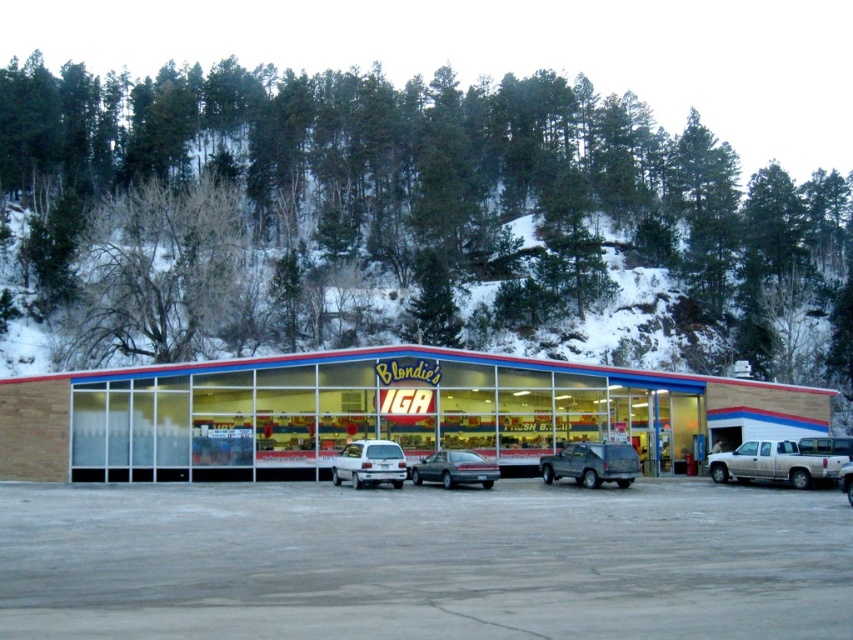
Looking at this image, does wooden siding building at center have a greater width compared to matte gray suv at center?

Indeed, wooden siding building at center has a greater width compared to matte gray suv at center.

Is wooden siding building at center positioned at the back of matte gray suv at center?

Yes, it is.

Does point (282, 372) lie in front of point (572, 467)?

That is False.

Identify the location of wooden siding building at center. (374, 412).

Does matte gray suv at center appear on the right side of white matte hatchback at center?

Correct, you'll find matte gray suv at center to the right of white matte hatchback at center.

Who is lower down, matte gray suv at center or white matte hatchback at center?

matte gray suv at center

Identify the location of matte gray suv at center. (590, 464).

Who is shorter, matte gray suv at center or silver metallic truck at center?

Standing shorter between the two is matte gray suv at center.

Is matte gray suv at center thinner than silver metallic truck at center?

Yes, matte gray suv at center is thinner than silver metallic truck at center.

Who is more forward, (563, 461) or (846, 492)?

Positioned in front is point (846, 492).

Where is `matte gray suv at center`? The width and height of the screenshot is (853, 640). matte gray suv at center is located at coordinates (590, 464).